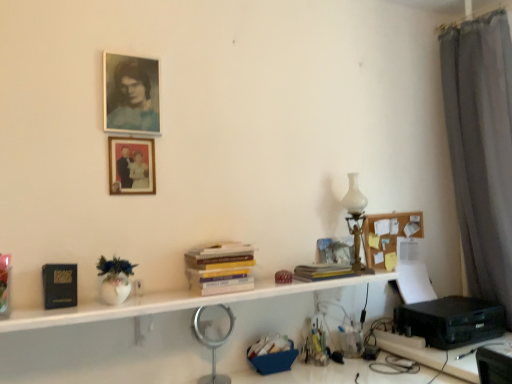
Question: From the image's perspective, does silver metallic magnifying glass at center appear higher than yellow paper at center, the first book positioned from the right?

Choices:
 (A) yes
 (B) no

Answer: (B)

Question: Does silver metallic magnifying glass at center have a greater height compared to yellow paper at center, the first book positioned from the right?

Choices:
 (A) yes
 (B) no

Answer: (A)

Question: Is the position of silver metallic magnifying glass at center more distant than that of yellow paper at center, which is the 2th book from left to right?

Choices:
 (A) no
 (B) yes

Answer: (A)

Question: Does silver metallic magnifying glass at center have a lesser height compared to yellow paper at center, which is the 2th book from left to right?

Choices:
 (A) no
 (B) yes

Answer: (A)

Question: Can you confirm if silver metallic magnifying glass at center is positioned to the right of yellow paper at center, which is the 2th book from left to right?

Choices:
 (A) no
 (B) yes

Answer: (A)

Question: Can yellow paper at center, which is the 2th book from left to right, be found inside silver metallic magnifying glass at center?

Choices:
 (A) no
 (B) yes

Answer: (A)

Question: Does black plastic printer at lower right appear on the right side of white glass table lamp at right?

Choices:
 (A) no
 (B) yes

Answer: (B)

Question: Does black plastic printer at lower right have a smaller size compared to white glass table lamp at right?

Choices:
 (A) yes
 (B) no

Answer: (B)

Question: Considering the relative sizes of black plastic printer at lower right and white glass table lamp at right in the image provided, is black plastic printer at lower right thinner than white glass table lamp at right?

Choices:
 (A) no
 (B) yes

Answer: (A)

Question: Is black plastic printer at lower right located outside white glass table lamp at right?

Choices:
 (A) yes
 (B) no

Answer: (A)

Question: Is black plastic printer at lower right directly adjacent to white glass table lamp at right?

Choices:
 (A) no
 (B) yes

Answer: (A)

Question: From the image's perspective, is black plastic printer at lower right beneath white glass table lamp at right?

Choices:
 (A) yes
 (B) no

Answer: (A)

Question: From a real-world perspective, is corkboard at upper right below matte paper portrait at upper left, which appears as the 2th picture frame when ordered from the bottom?

Choices:
 (A) no
 (B) yes

Answer: (B)